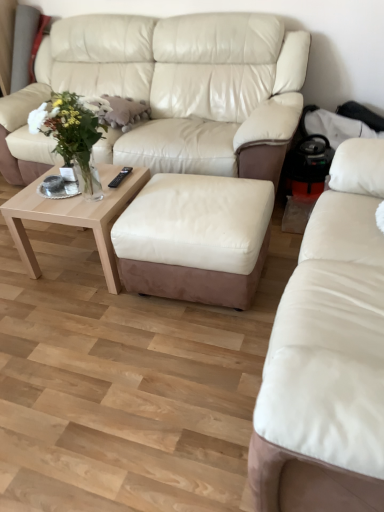
Question: Which direction should I rotate to look at light wood/texture coffee table at lower center?

Choices:
 (A) left
 (B) right

Answer: (A)

Question: Does translucent glass vase at center have a greater width compared to white leather ottoman at center?

Choices:
 (A) no
 (B) yes

Answer: (A)

Question: From the image's perspective, is translucent glass vase at center beneath white leather ottoman at center?

Choices:
 (A) yes
 (B) no

Answer: (B)

Question: From a real-world perspective, is translucent glass vase at center located higher than white leather ottoman at center?

Choices:
 (A) no
 (B) yes

Answer: (B)

Question: Does translucent glass vase at center lie in front of white leather ottoman at center?

Choices:
 (A) yes
 (B) no

Answer: (A)

Question: Is translucent glass vase at center shorter than white leather ottoman at center?

Choices:
 (A) yes
 (B) no

Answer: (B)

Question: Is translucent glass vase at center at the left side of white leather ottoman at center?

Choices:
 (A) no
 (B) yes

Answer: (B)

Question: Does translucent glass vase at center turn towards leather studio couch at center, which is the 2th studio couch from back to front?

Choices:
 (A) no
 (B) yes

Answer: (A)

Question: Is translucent glass vase at center further to the viewer compared to leather studio couch at center, which is the 2th studio couch from back to front?

Choices:
 (A) yes
 (B) no

Answer: (A)

Question: Can you confirm if translucent glass vase at center is shorter than leather studio couch at center, which is the 2th studio couch from back to front?

Choices:
 (A) yes
 (B) no

Answer: (A)

Question: From a real-world perspective, is translucent glass vase at center located beneath leather studio couch at center, placed as the first studio couch when sorted from front to back?

Choices:
 (A) yes
 (B) no

Answer: (B)

Question: Could leather studio couch at center, which is the 2th studio couch from back to front, be considered to be inside translucent glass vase at center?

Choices:
 (A) yes
 (B) no

Answer: (B)

Question: From a real-world perspective, is translucent glass vase at center physically above leather studio couch at center, which is the 2th studio couch from back to front?

Choices:
 (A) no
 (B) yes

Answer: (B)

Question: Is white leather ottoman at center further to the viewer compared to light wood/texture coffee table at lower center?

Choices:
 (A) no
 (B) yes

Answer: (A)